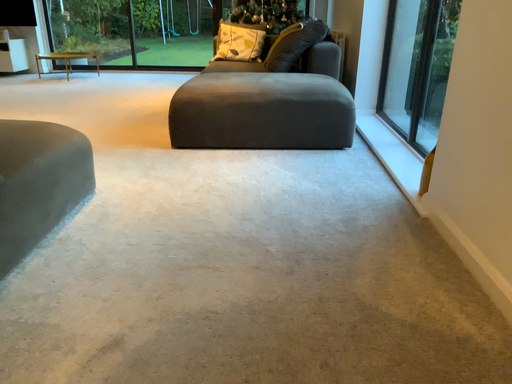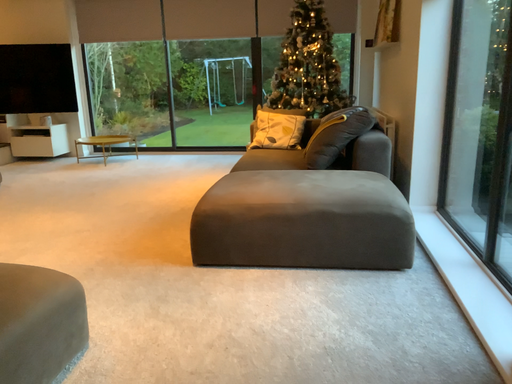
Question: How did the camera likely rotate when shooting the video?

Choices:
 (A) rotated upward
 (B) rotated downward

Answer: (A)